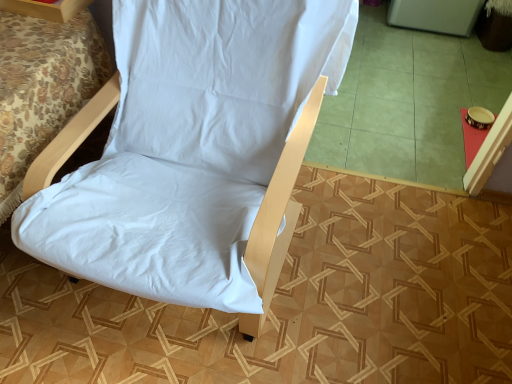
Where is `white fabric bed at lower left`? The width and height of the screenshot is (512, 384). white fabric bed at lower left is located at coordinates (x=42, y=88).

Considering the sizes of white fabric chair at upper left and white fabric chair at center in the image, is white fabric chair at upper left bigger or smaller than white fabric chair at center?

In the image, white fabric chair at upper left appears to be smaller than white fabric chair at center.

From a real-world perspective, which is physically above, white fabric chair at upper left or white fabric chair at center?

white fabric chair at upper left.

Is white fabric chair at upper left shorter than white fabric chair at center?

Correct, white fabric chair at upper left is not as tall as white fabric chair at center.

Which is closer to the camera, (59, 16) or (295, 202)?

Point (59, 16).

From the image's perspective, does white fabric chair at center appear higher than white fabric bed at lower left?

No, from the image's perspective, white fabric chair at center is not above white fabric bed at lower left.

Is white fabric chair at center at the right side of white fabric bed at lower left?

Indeed, white fabric chair at center is positioned on the right side of white fabric bed at lower left.

Considering the sizes of objects white fabric chair at center and white fabric bed at lower left in the image provided, who is thinner, white fabric chair at center or white fabric bed at lower left?

white fabric chair at center is thinner.

Considering the relative sizes of white fabric chair at center and white fabric bed at lower left in the image provided, is white fabric chair at center smaller than white fabric bed at lower left?

No.

How many degrees apart are the facing directions of white fabric bed at lower left and green tile at center?

The angular difference between white fabric bed at lower left and green tile at center is 0.0701 degrees.

Considering the sizes of objects white fabric bed at lower left and green tile at center in the image provided, who is shorter, white fabric bed at lower left or green tile at center?

green tile at center is shorter.

Is white fabric bed at lower left facing away from green tile at center?

white fabric bed at lower left is not turned away from green tile at center.

Who is bigger, white fabric bed at lower left or green tile at center?

With larger size is white fabric bed at lower left.

In the scene shown: Who is taller, green tile at center or white fabric chair at upper left?

With more height is white fabric chair at upper left.

Is green tile at center at the left side of white fabric chair at upper left?

No.

From the image's perspective, which one is positioned lower, green tile at center or white fabric chair at upper left?

white fabric chair at upper left, from the image's perspective.

Could you tell me if green tile at center is turned towards white fabric chair at upper left?

No, green tile at center is not facing towards white fabric chair at upper left.

Considering their positions, is white fabric chair at upper left located in front of or behind white fabric bed at lower left?

Clearly, white fabric chair at upper left is behind white fabric bed at lower left.

Is white fabric chair at upper left to the right of white fabric bed at lower left from the viewer's perspective?

Yes.

Which is closer, (5, 1) or (11, 65)?

Point (5, 1) is positioned farther from the camera compared to point (11, 65).

Is green tile at center wider than white fabric bed at lower left?

Indeed, green tile at center has a greater width compared to white fabric bed at lower left.

Is green tile at center turned away from white fabric bed at lower left?

No, green tile at center's orientation is not away from white fabric bed at lower left.

From their relative heights in the image, would you say green tile at center is taller or shorter than white fabric bed at lower left?

green tile at center is shorter than white fabric bed at lower left.

From the image's perspective, which is below, green tile at center or white fabric bed at lower left?

From the image's view, white fabric bed at lower left is below.

Between green tile at center and white fabric chair at center, which one appears on the right side from the viewer's perspective?

green tile at center.

Is point (462, 97) less distant than point (259, 238)?

No, (462, 97) is behind (259, 238).

Consider the image. Looking at their sizes, would you say green tile at center is wider or thinner than white fabric chair at center?

In the image, green tile at center appears to be wider than white fabric chair at center.

You are a GUI agent. You are given a task and a screenshot of the screen. Output one action in this format:
    pyautogui.click(x=<x>, y=<y>)
    Task: Click on the furnurniture that appears below the white fabric chair at upper left (from a real-world perspective)
    
    Given the screenshot: What is the action you would take?
    pyautogui.click(x=278, y=213)

The width and height of the screenshot is (512, 384). In order to click on bed behind the white fabric chair at center in this screenshot , I will do `click(42, 88)`.

In the scene shown: Considering their positions, is white fabric chair at upper left positioned closer to white fabric bed at lower left than green tile at center?

Among the two, white fabric chair at upper left is located nearer to white fabric bed at lower left.

Which object lies nearer to the anchor point white fabric chair at center, white fabric chair at upper left or green tile at center?

white fabric chair at upper left.

Estimate the real-world distances between objects in this image. Which object is further from white fabric chair at center, white fabric bed at lower left or white fabric chair at upper left?

white fabric chair at upper left.

When comparing their distances from white fabric chair at upper left, does green tile at center or white fabric bed at lower left seem closer?

white fabric bed at lower left.

Looking at the image, which one is located closer to white fabric chair at center, white fabric bed at lower left or green tile at center?

white fabric bed at lower left.

Which object lies nearer to the anchor point green tile at center, white fabric chair at upper left or white fabric chair at center?

white fabric chair at center.

Consider the image. Considering their positions, is white fabric chair at center positioned closer to green tile at center than white fabric bed at lower left?

white fabric chair at center is closer to green tile at center.

Considering their positions, is green tile at center positioned further to white fabric bed at lower left than white fabric chair at upper left?

The object further to white fabric bed at lower left is green tile at center.

The height and width of the screenshot is (384, 512). What are the coordinates of `bed located between white fabric chair at center and white fabric chair at upper left in the depth direction` in the screenshot? It's located at (42, 88).

Locate an element on the screen. The width and height of the screenshot is (512, 384). furnurniture between white fabric chair at upper left and green tile at center from left to right is located at coordinates (278, 213).

The height and width of the screenshot is (384, 512). In order to click on furnurniture between white fabric bed at lower left and green tile at center from left to right in this screenshot , I will do `click(278, 213)`.

Identify the location of furniture situated between white fabric bed at lower left and green tile at center from left to right. (45, 8).